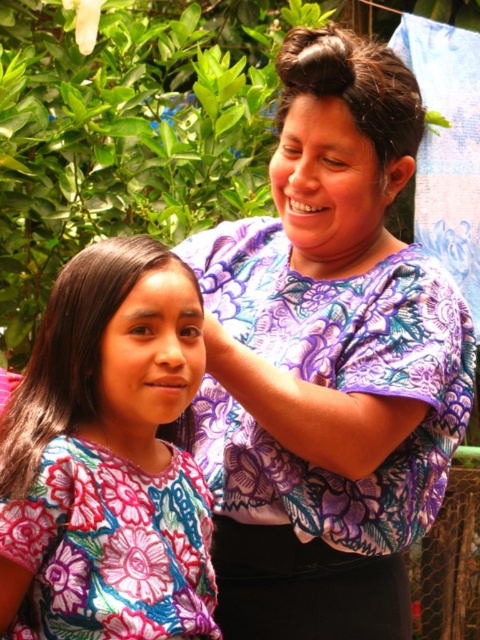
Question: Does floral fabric dress at left appear on the right side of dark brown silky hair at upper center?

Choices:
 (A) no
 (B) yes

Answer: (A)

Question: Observing the image, what is the correct spatial positioning of floral fabric dress at left in reference to dark brown silky hair at upper center?

Choices:
 (A) below
 (B) above

Answer: (A)

Question: From the image, what is the correct spatial relationship of floral fabric dress at left in relation to dark brown silky hair at upper center?

Choices:
 (A) left
 (B) right

Answer: (A)

Question: Which point is closer to the camera?

Choices:
 (A) floral fabric dress at left
 (B) dark brown silky hair at upper center

Answer: (A)